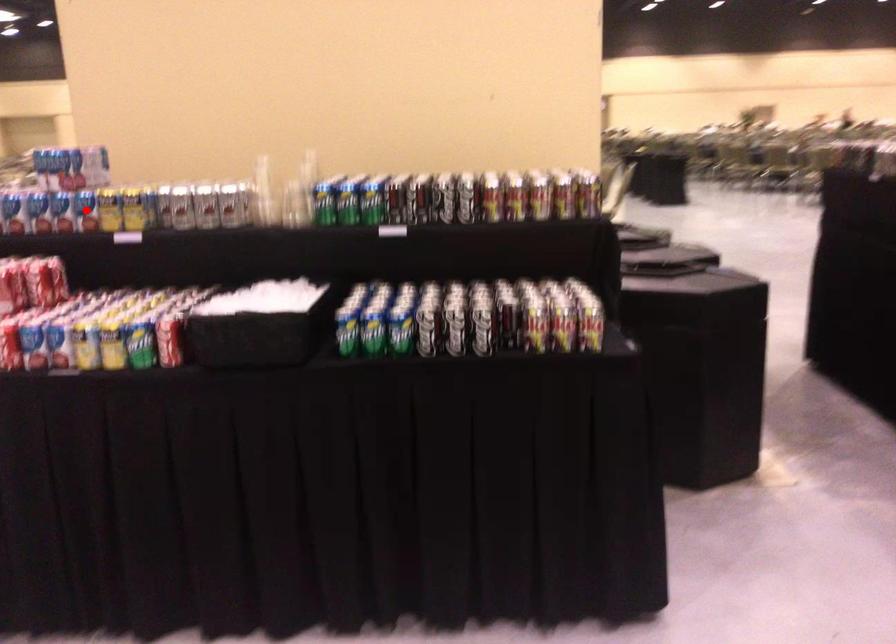
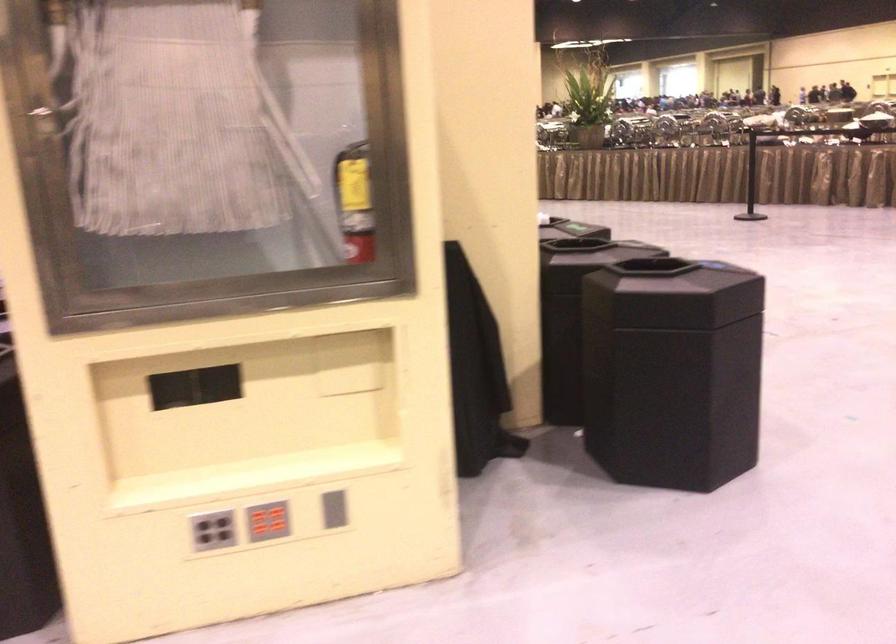
Question: I am providing you with two images of the same scene from different viewpoints. A red point is marked on the first image. Is the red point's position out of view in image 2?

Choices:
 (A) Yes
 (B) No

Answer: (A)